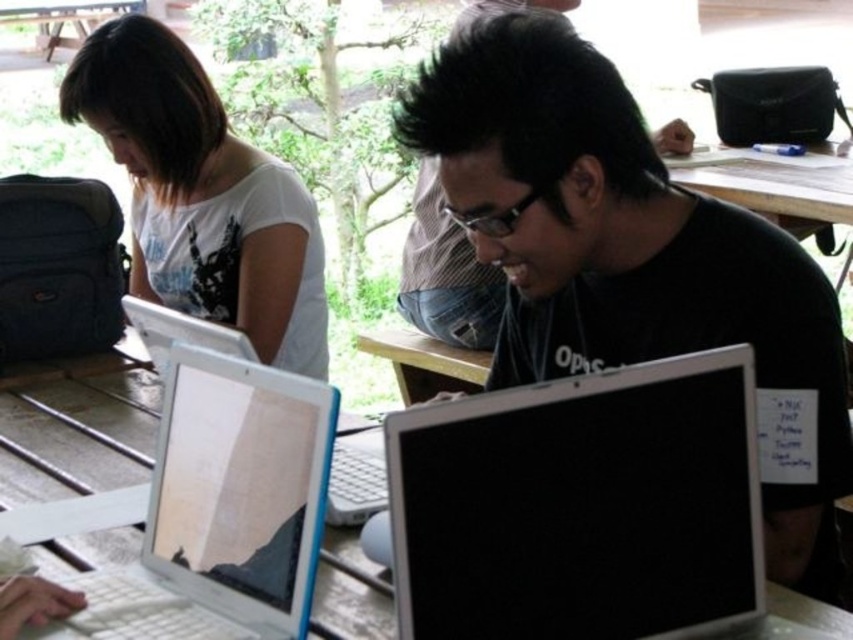
Is white plastic laptop at center to the left of wooden picnic table at upper left from the viewer's perspective?

No, white plastic laptop at center is not to the left of wooden picnic table at upper left.

Does white plastic laptop at center appear over wooden picnic table at upper left?

No, white plastic laptop at center is not above wooden picnic table at upper left.

Image resolution: width=853 pixels, height=640 pixels. What are the coordinates of `white plastic laptop at center` in the screenshot? It's located at (180, 332).

Is point (143, 589) farther from viewer compared to point (238, 180)?

No.

Which is more to the right, silver plastic laptop at left or white matte shirt at upper left?

silver plastic laptop at left is more to the right.

Is point (282, 534) positioned in front of point (247, 154)?

That is True.

Locate an element on the screen. silver plastic laptop at left is located at coordinates (221, 512).

Is silver plastic laptop at left further to the viewer compared to wooden picnic table at upper left?

No.

Can you confirm if silver plastic laptop at left is taller than wooden picnic table at upper left?

Yes.

The image size is (853, 640). I want to click on silver plastic laptop at left, so click(x=221, y=512).